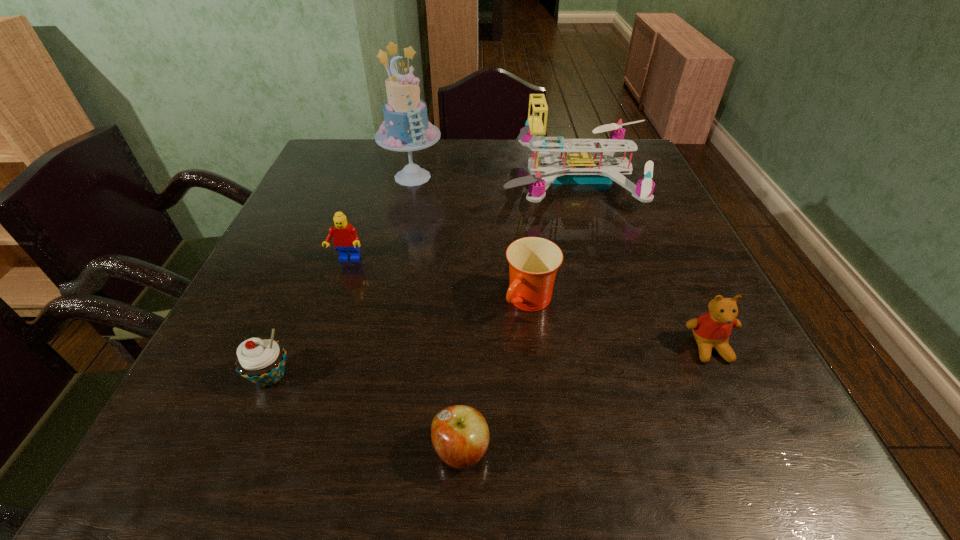
This screenshot has height=540, width=960. What are the coordinates of `cake` in the screenshot? It's located at [405, 128].

Locate an element on the screen. This screenshot has width=960, height=540. the sixth shortest object is located at coordinates coord(579,167).

Find the location of a particular element. the third farthest object is located at coordinates (345, 238).

Identify the location of teddy bear. (711, 330).

Identify the location of cup. The width and height of the screenshot is (960, 540). (533, 261).

The width and height of the screenshot is (960, 540). I want to click on cupcake, so click(x=261, y=361).

The height and width of the screenshot is (540, 960). Find the location of `apple`. apple is located at coordinates (460, 435).

You are a GUI agent. You are given a task and a screenshot of the screen. Output one action in this format:
    pyautogui.click(x=<x>, y=<y>)
    Task: Click on the shortest object
    The image size is (960, 540).
    Given the screenshot: What is the action you would take?
    pyautogui.click(x=460, y=435)

The height and width of the screenshot is (540, 960). Find the location of `vacant area situated 0.350m with a ladder on the side of the cake`. vacant area situated 0.350m with a ladder on the side of the cake is located at coordinates (389, 287).

Where is `free location located on the front-facing side of the drone`? The height and width of the screenshot is (540, 960). free location located on the front-facing side of the drone is located at coordinates [x=478, y=179].